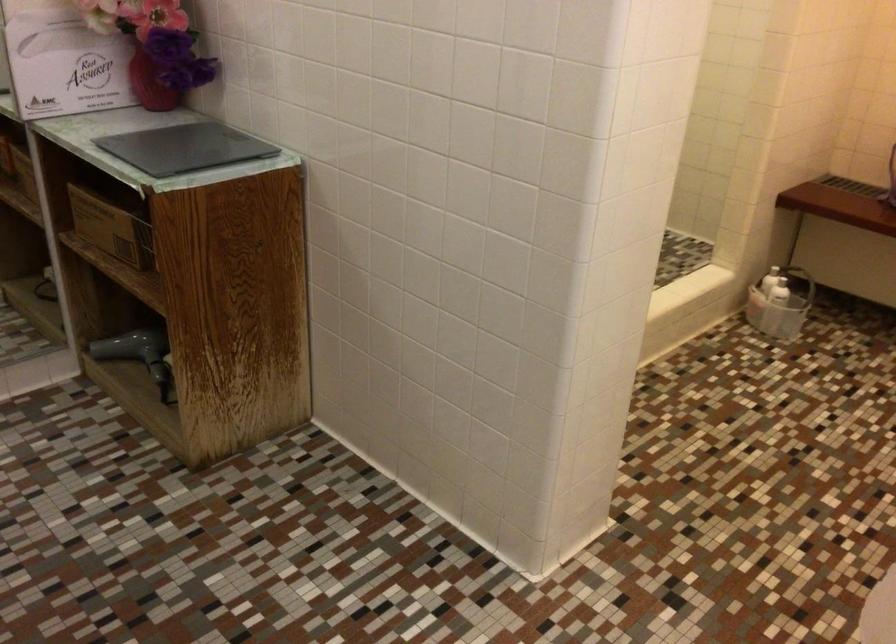
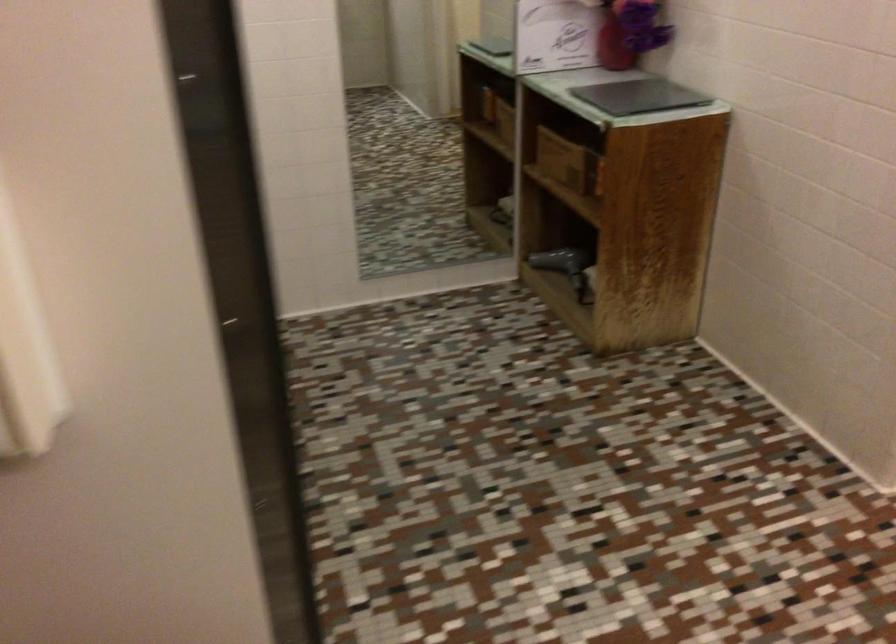
Question: I am providing you with two images of the same scene from different viewpoints. After the viewpoint changes to image2, which objects are now occluded?

Choices:
 (A) red vase
 (B) grey hair dryer
 (C) black folder
 (D) none of these

Answer: (D)